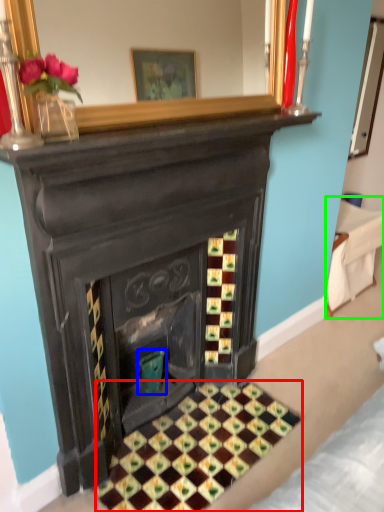
Question: Which object is positioned closest to pattern (highlighted by a red box)? Select from teal (highlighted by a blue box) and furniture (highlighted by a green box).

Choices:
 (A) teal
 (B) furniture

Answer: (A)